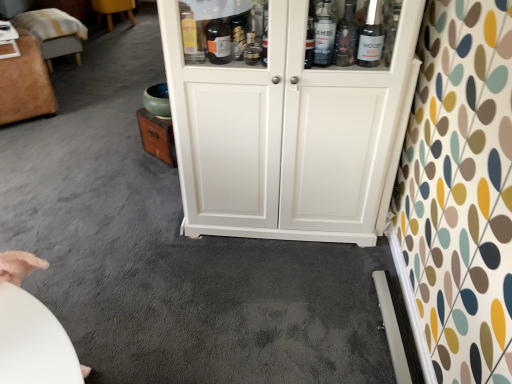
Question: Is velvet ottoman at left, which is the third furniture from back to front, surrounded by white glossy table at upper left?

Choices:
 (A) no
 (B) yes

Answer: (A)

Question: Can you confirm if white glossy table at upper left is taller than velvet ottoman at left, marked as the 1th furniture in a front-to-back arrangement?

Choices:
 (A) yes
 (B) no

Answer: (B)

Question: Is white glossy table at upper left behind velvet ottoman at left, which is the third furniture from back to front?

Choices:
 (A) yes
 (B) no

Answer: (A)

Question: Is white glossy table at upper left positioned in front of velvet ottoman at left, which is the third furniture from back to front?

Choices:
 (A) no
 (B) yes

Answer: (A)

Question: Is white glossy table at upper left smaller than velvet ottoman at left, which is the third furniture from back to front?

Choices:
 (A) yes
 (B) no

Answer: (A)

Question: From a real-world perspective, does white glossy table at upper left stand above velvet ottoman at left, marked as the 1th furniture in a front-to-back arrangement?

Choices:
 (A) no
 (B) yes

Answer: (B)

Question: Considering the relative sizes of velvet ottoman at left, which is the third furniture from back to front, and wooden stool at upper left, which ranks as the first furniture in back-to-front order, in the image provided, is velvet ottoman at left, which is the third furniture from back to front, wider than wooden stool at upper left, which ranks as the first furniture in back-to-front order,?

Choices:
 (A) yes
 (B) no

Answer: (A)

Question: Is the depth of velvet ottoman at left, marked as the 1th furniture in a front-to-back arrangement, greater than that of wooden stool at upper left, the third furniture positioned from the front?

Choices:
 (A) no
 (B) yes

Answer: (A)

Question: Is velvet ottoman at left, marked as the 1th furniture in a front-to-back arrangement, with wooden stool at upper left, which ranks as the first furniture in back-to-front order?

Choices:
 (A) yes
 (B) no

Answer: (B)

Question: Could wooden stool at upper left, which ranks as the first furniture in back-to-front order, be considered to be inside velvet ottoman at left, which is the third furniture from back to front?

Choices:
 (A) yes
 (B) no

Answer: (B)

Question: Is velvet ottoman at left, which is the third furniture from back to front, closer to camera compared to wooden stool at upper left, the third furniture positioned from the front?

Choices:
 (A) yes
 (B) no

Answer: (A)

Question: From a real-world perspective, is velvet ottoman at left, marked as the 1th furniture in a front-to-back arrangement, on wooden stool at upper left, which ranks as the first furniture in back-to-front order?

Choices:
 (A) yes
 (B) no

Answer: (A)

Question: Does white glossy table at upper left appear on the right side of white wood cupboard at center?

Choices:
 (A) no
 (B) yes

Answer: (A)